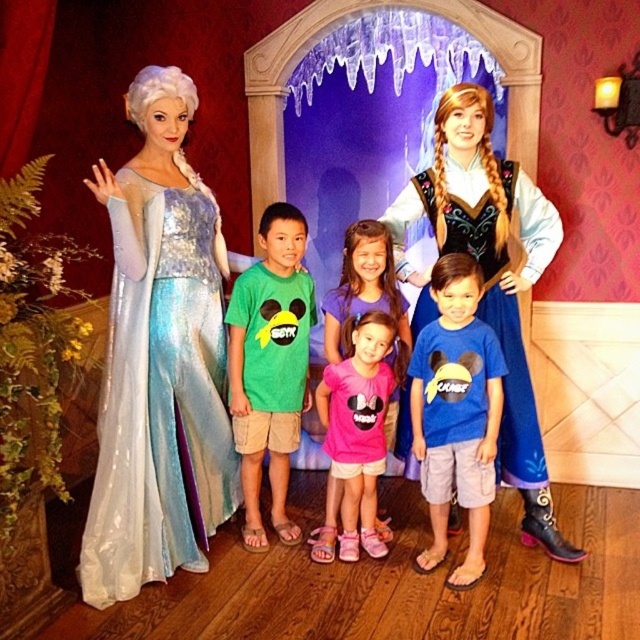
You are a photographer trying to capture the blue cotton shirt at center in the image. According to the coordinates provided, where should you focus your camera?

The blue cotton shirt at center is located at coordinates point (456, 412).

You are a photographer at the event and want to capture a photo that includes both the point at (132, 221) and the point at (353, 493). Based on their positions, which point should you focus on first to ensure both are in frame?

Since point (132, 221) is in front of point (353, 493), you should focus on the point at (132, 221) first to ensure both are in frame as it is closer to the camera.

You are a photographer at the event and need to capture a clear photo of both the satin shimmering gown at left and the pink fabric shirt at center. Which object should you focus on first to ensure both are in focus?

The satin shimmering gown at left is positioned over the pink fabric shirt at center, so you should focus on the satin shimmering gown at left first to ensure both are in focus.